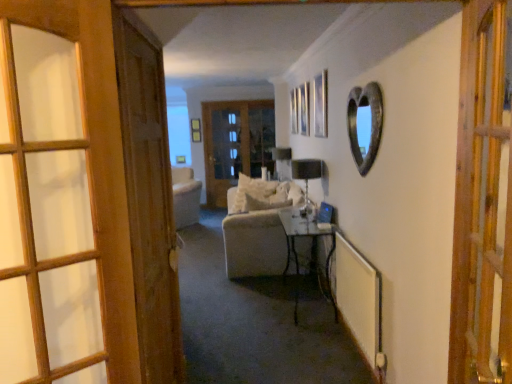
Question: In which direction should I rotate to look at matte wooden picture frame at upper center, acting as the first picture frame starting from the top?

Choices:
 (A) right
 (B) left

Answer: (B)

Question: From the image's perspective, does rustic metal heart-shaped mirror at upper right appear lower than matte black lampshade at center, which ranks as the first lamp in back-to-front order?

Choices:
 (A) no
 (B) yes

Answer: (B)

Question: Does rustic metal heart-shaped mirror at upper right come in front of matte black lampshade at center, placed as the second lamp when sorted from front to back?

Choices:
 (A) no
 (B) yes

Answer: (B)

Question: Would you say rustic metal heart-shaped mirror at upper right is outside matte black lampshade at center, which ranks as the first lamp in back-to-front order?

Choices:
 (A) no
 (B) yes

Answer: (B)

Question: Would you say rustic metal heart-shaped mirror at upper right contains matte black lampshade at center, placed as the second lamp when sorted from front to back?

Choices:
 (A) no
 (B) yes

Answer: (A)

Question: Does rustic metal heart-shaped mirror at upper right have a lesser height compared to matte black lampshade at center, which ranks as the first lamp in back-to-front order?

Choices:
 (A) yes
 (B) no

Answer: (B)

Question: Does rustic metal heart-shaped mirror at upper right turn towards matte black lampshade at center, placed as the second lamp when sorted from front to back?

Choices:
 (A) no
 (B) yes

Answer: (A)

Question: Can you confirm if wooden door at left, positioned as the first door in left-to-right order, is positioned to the left of wooden door at left, placed as the 3th door when sorted from right to left?

Choices:
 (A) yes
 (B) no

Answer: (A)

Question: Can you confirm if wooden door at left, the second door in the front-to-back sequence, is wider than wooden door at left, acting as the second door starting from the left?

Choices:
 (A) no
 (B) yes

Answer: (B)

Question: Considering the relative positions of wooden door at left, positioned as the first door in left-to-right order, and wooden door at left, acting as the second door starting from the left, in the image provided, is wooden door at left, positioned as the first door in left-to-right order, to the right of wooden door at left, acting as the second door starting from the left, from the viewer's perspective?

Choices:
 (A) yes
 (B) no

Answer: (B)

Question: Can you see wooden door at left, the second door in the front-to-back sequence, touching wooden door at left, the second door from the back?

Choices:
 (A) no
 (B) yes

Answer: (A)

Question: Considering the relative sizes of wooden door at left, which is counted as the 4th door, starting from the right, and wooden door at left, the second door from the back, in the image provided, is wooden door at left, which is counted as the 4th door, starting from the right, shorter than wooden door at left, the second door from the back,?

Choices:
 (A) no
 (B) yes

Answer: (B)

Question: Is white soft pillow at center positioned in front of matte wooden picture frame at upper center, which ranks as the 2th picture frame in front-to-back order?

Choices:
 (A) yes
 (B) no

Answer: (A)